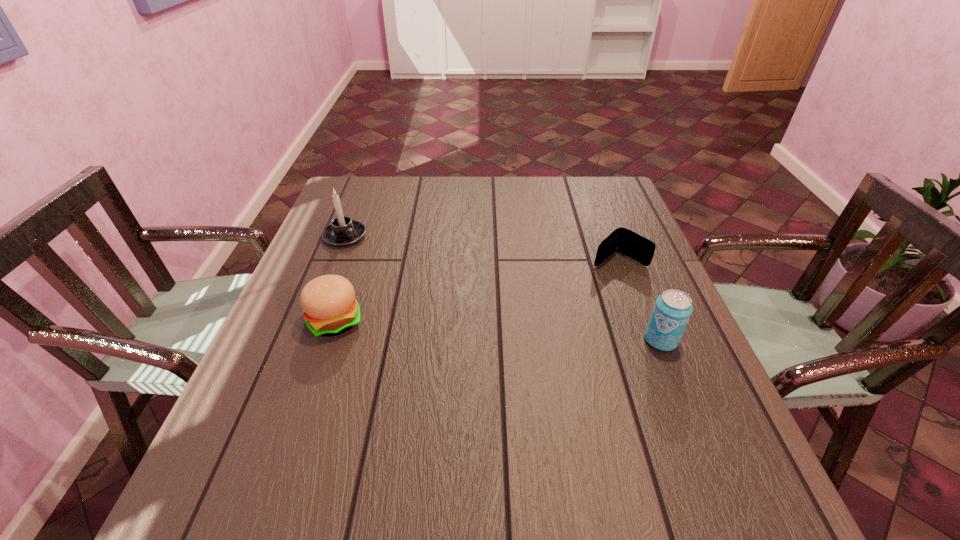
Locate an element on the screen. The height and width of the screenshot is (540, 960). free space on the desktop that is between the hamburger and the beer can and is positioned with a handle on the side of the farthest object is located at coordinates (461, 328).

This screenshot has height=540, width=960. I want to click on free space on the desktop that is between the third tallest object and the beer can and is positioned on the outer surface of the second farthest object, so click(531, 333).